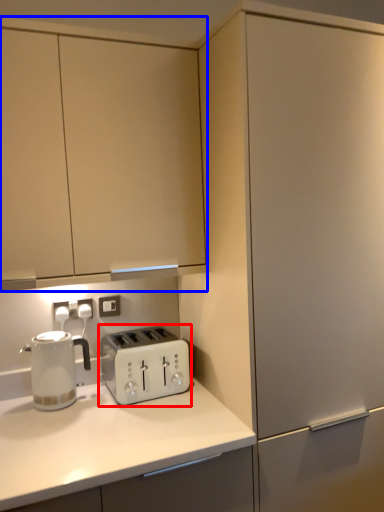
Question: Which object is closer to the camera taking this photo, toaster (highlighted by a red box) or cabinetry (highlighted by a blue box)?

Choices:
 (A) toaster
 (B) cabinetry

Answer: (B)